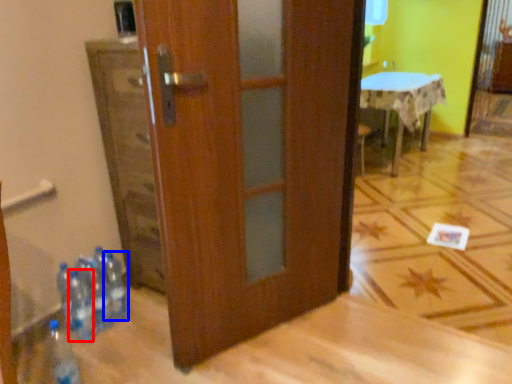
Question: Which point is further to the camera, bottle (highlighted by a red box) or bottle (highlighted by a blue box)?

Choices:
 (A) bottle
 (B) bottle

Answer: (B)